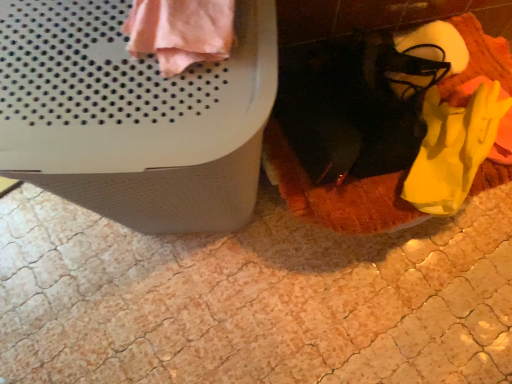
Question: Can we say yellow fabric shoe at lower right lies outside pink fabric at upper left?

Choices:
 (A) yes
 (B) no

Answer: (A)

Question: Is yellow fabric shoe at lower right wider than pink fabric at upper left?

Choices:
 (A) yes
 (B) no

Answer: (B)

Question: Is yellow fabric shoe at lower right thinner than pink fabric at upper left?

Choices:
 (A) no
 (B) yes

Answer: (B)

Question: Would you say yellow fabric shoe at lower right is a long distance from pink fabric at upper left?

Choices:
 (A) yes
 (B) no

Answer: (B)

Question: From a real-world perspective, does yellow fabric shoe at lower right stand above pink fabric at upper left?

Choices:
 (A) yes
 (B) no

Answer: (B)

Question: Is yellow fabric shoe at lower right oriented away from pink fabric at upper left?

Choices:
 (A) yes
 (B) no

Answer: (B)

Question: Can you confirm if soft orange blanket at lower right is wider than yellow fabric shoe at lower right?

Choices:
 (A) yes
 (B) no

Answer: (A)

Question: Is soft orange blanket at lower right closer to camera compared to yellow fabric shoe at lower right?

Choices:
 (A) yes
 (B) no

Answer: (A)

Question: Would you say yellow fabric shoe at lower right is part of soft orange blanket at lower right's contents?

Choices:
 (A) yes
 (B) no

Answer: (A)

Question: Considering the relative sizes of soft orange blanket at lower right and yellow fabric shoe at lower right in the image provided, is soft orange blanket at lower right taller than yellow fabric shoe at lower right?

Choices:
 (A) no
 (B) yes

Answer: (B)

Question: Is soft orange blanket at lower right oriented towards yellow fabric shoe at lower right?

Choices:
 (A) yes
 (B) no

Answer: (B)

Question: Is soft orange blanket at lower right positioned with its back to yellow fabric shoe at lower right?

Choices:
 (A) yes
 (B) no

Answer: (B)

Question: Is pink fabric at upper left thinner than soft orange blanket at lower right?

Choices:
 (A) no
 (B) yes

Answer: (B)